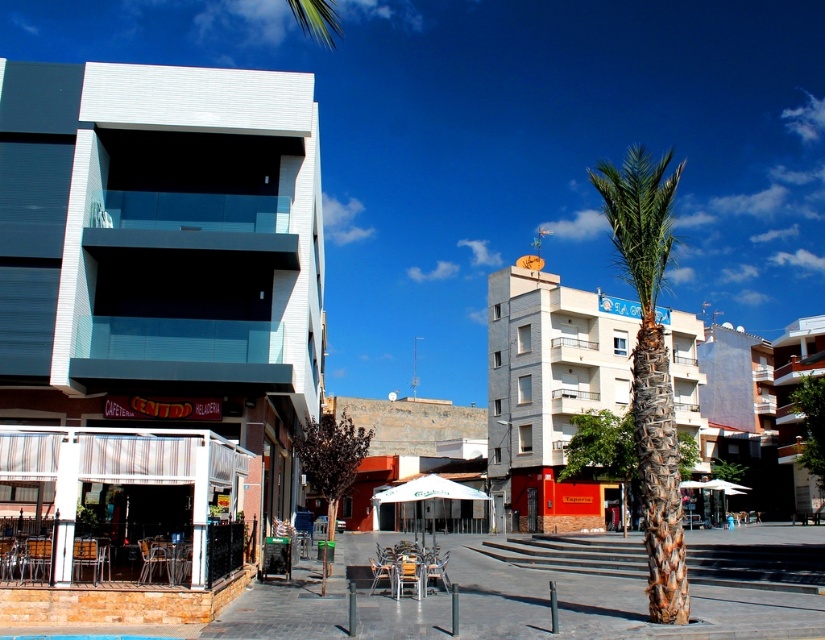
Question: Which point is closer to the camera?

Choices:
 (A) white textured building at left
 (B) white brick building at center

Answer: (A)

Question: Can you confirm if white textured building at left is smaller than white concrete building at right?

Choices:
 (A) yes
 (B) no

Answer: (B)

Question: Does white textured building at left appear over white concrete building at right?

Choices:
 (A) no
 (B) yes

Answer: (B)

Question: Is white textured building at left bigger than green textured palm tree at center?

Choices:
 (A) no
 (B) yes

Answer: (A)

Question: Estimate the real-world distances between objects in this image. Which object is farther from the white brick building at center?

Choices:
 (A) white concrete building at right
 (B) white textured building at left

Answer: (B)

Question: Among these objects, which one is nearest to the camera?

Choices:
 (A) white concrete building at right
 (B) green textured palm tree at center
 (C) white brick building at center

Answer: (B)